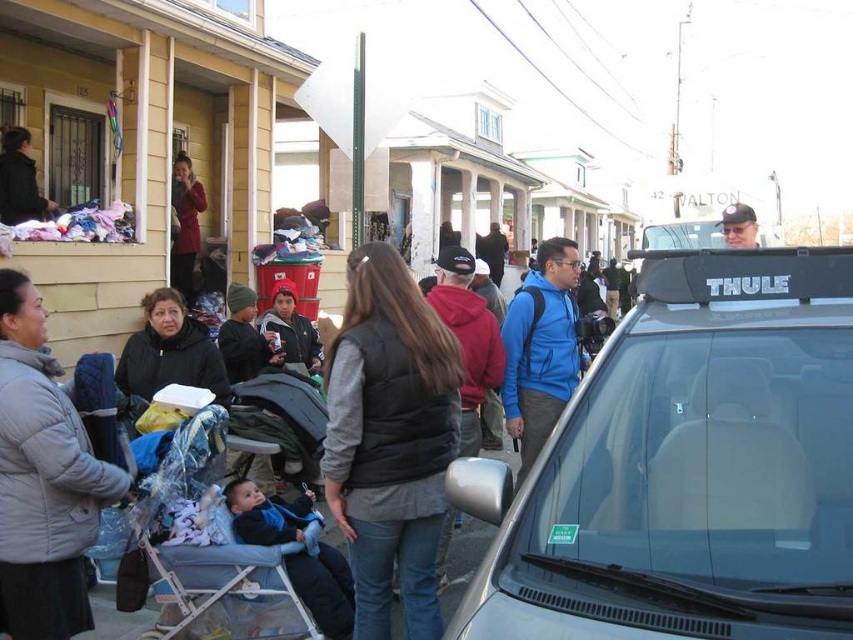
Question: Which point appears closest to the camera in this image?

Choices:
 (A) coord(486,545)
 (B) coord(532,273)
 (C) coord(77,611)
 (D) coord(752,230)

Answer: (C)

Question: Is gray puffy jacket at lower left wider than matte black jacket at upper left?

Choices:
 (A) yes
 (B) no

Answer: (B)

Question: Can you confirm if matte red coat at upper left is positioned below matte black stroller at lower left?

Choices:
 (A) yes
 (B) no

Answer: (B)

Question: Which object is the farthest from the matte red coat at upper left?

Choices:
 (A) gray fabric baby carriage at lower left
 (B) blue fabric baby carrier at lower left

Answer: (A)

Question: Which object is positioned closest to the gray fabric baby carriage at lower left?

Choices:
 (A) gray puffy jacket at lower left
 (B) matte black cap at upper right
 (C) silver metallic car at center

Answer: (A)

Question: Is dark gray vest at center closer to the viewer compared to matte black jacket at upper left?

Choices:
 (A) yes
 (B) no

Answer: (A)